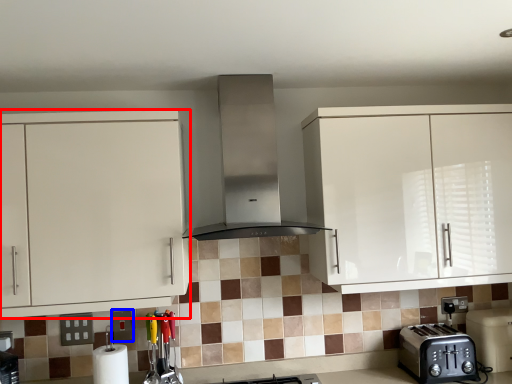
Question: Which point is closer to the camera, cabinetry (highlighted by a red box) or square (highlighted by a blue box)?

Choices:
 (A) cabinetry
 (B) square

Answer: (A)